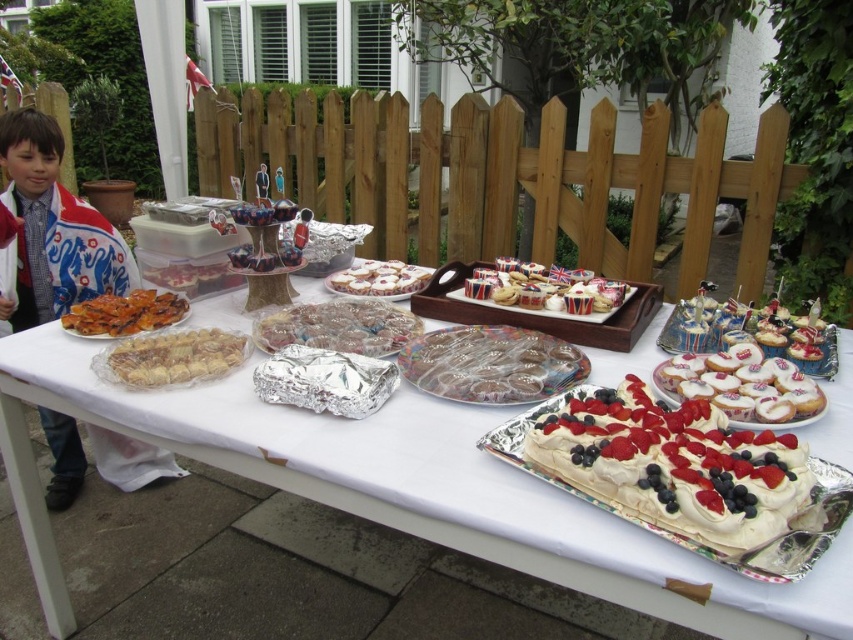
Question: Which is farther from the union jack paper cupcake at center?

Choices:
 (A) translucent plastic cookies at center
 (B) white paper table at center
 (C) golden brown pastry at left
 (D) white frosted cupcake at center

Answer: (C)

Question: Is clear plastic cups at center in front of union jack paper cupcake at center?

Choices:
 (A) yes
 (B) no

Answer: (A)

Question: Does translucent plastic cookies at center have a smaller size compared to white glossy tray at center?

Choices:
 (A) yes
 (B) no

Answer: (B)

Question: Is white paper table at center thinner than clear plastic cups at center?

Choices:
 (A) no
 (B) yes

Answer: (A)

Question: Which object appears closest to the camera in this image?

Choices:
 (A) union jack paper cupcake at center
 (B) white fabric scarf at left

Answer: (A)

Question: Which point appears closest to the camera in this image?

Choices:
 (A) (820, 392)
 (B) (392, 284)
 (C) (462, 337)

Answer: (A)